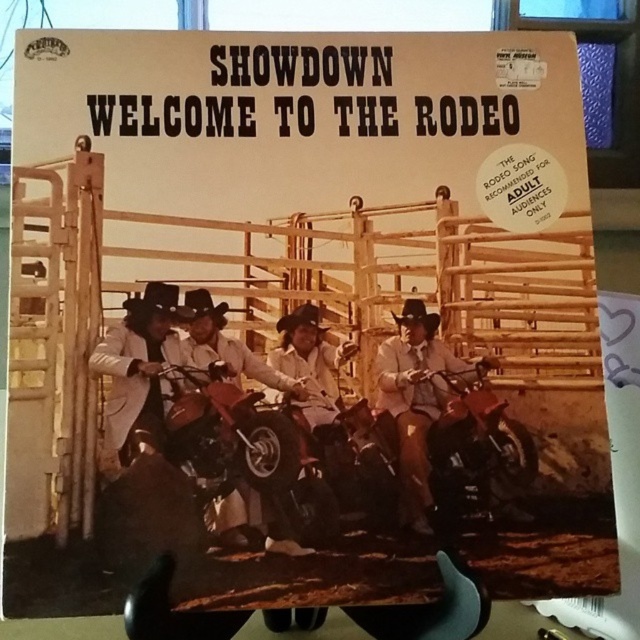
Question: Which is nearer to the brown felt cowboy hat at center?

Choices:
 (A) black felt cowboy hat at left
 (B) leather cowboy hat at center
 (C) light beige leather jacket at center

Answer: (B)

Question: Does light beige leather jacket at center lie in front of leather cowboy hat at center?

Choices:
 (A) yes
 (B) no

Answer: (A)

Question: Can you confirm if light beige leather jacket at center is positioned to the left of black felt cowboy hat at center?

Choices:
 (A) yes
 (B) no

Answer: (A)

Question: Estimate the real-world distances between objects in this image. Which object is farther from the black felt cowboy hat at center?

Choices:
 (A) light brown leather jacket at center
 (B) light beige leather jacket at center

Answer: (A)

Question: Which object appears farthest from the camera in this image?

Choices:
 (A) black felt cowboy hat at center
 (B) light beige leather jacket at center

Answer: (A)

Question: Is light beige leather jacket at center bigger than black felt cowboy hat at left?

Choices:
 (A) yes
 (B) no

Answer: (A)